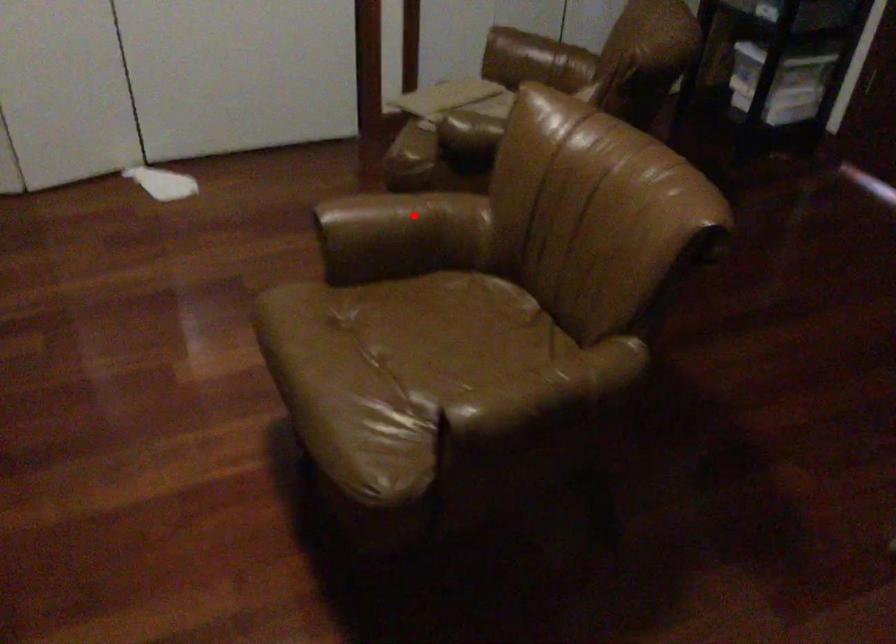
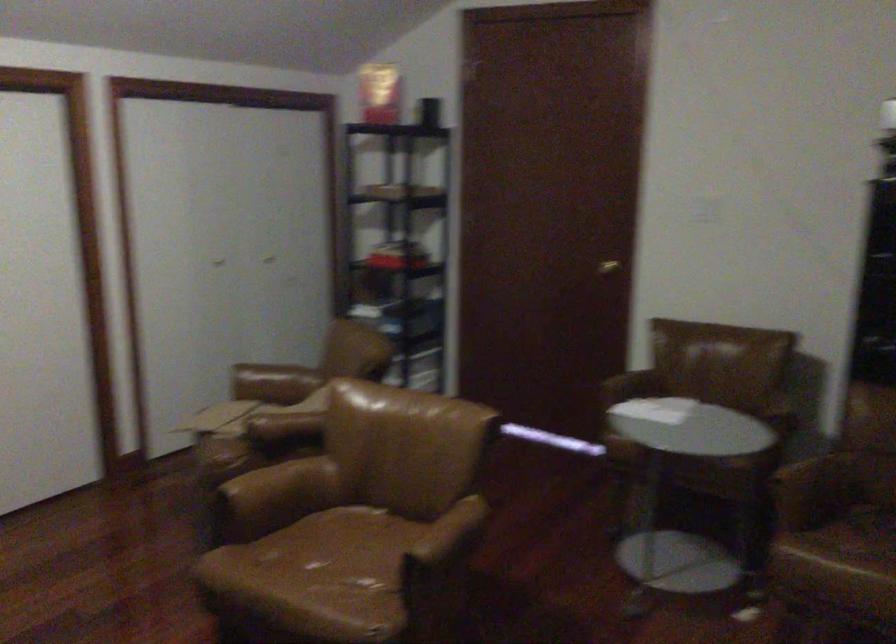
Question: I am providing you with two images of the same scene from different viewpoints. Given a red point in image1, look at the same physical point in image2. Is it:

Choices:
 (A) Closer to the viewpoint
 (B) Farther from the viewpoint

Answer: (B)